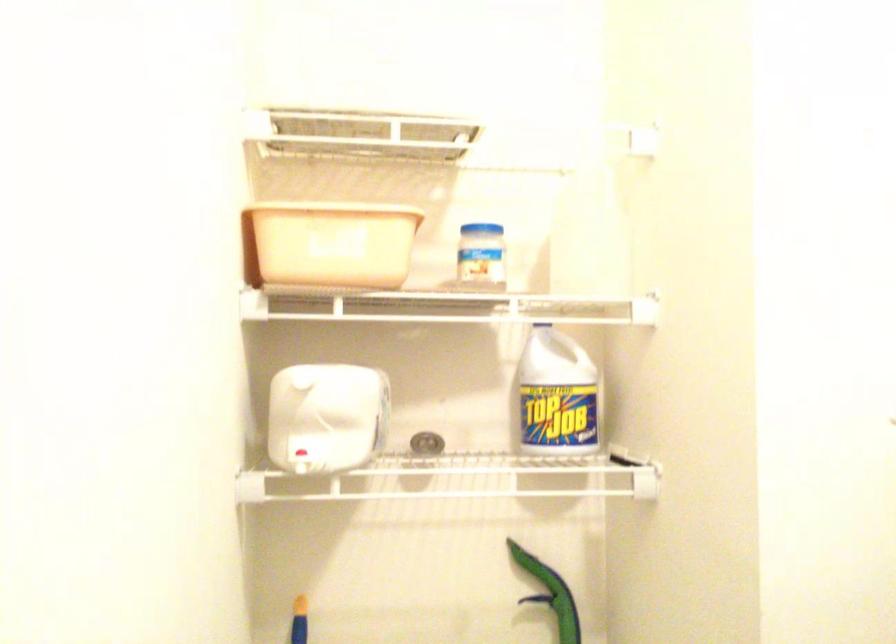
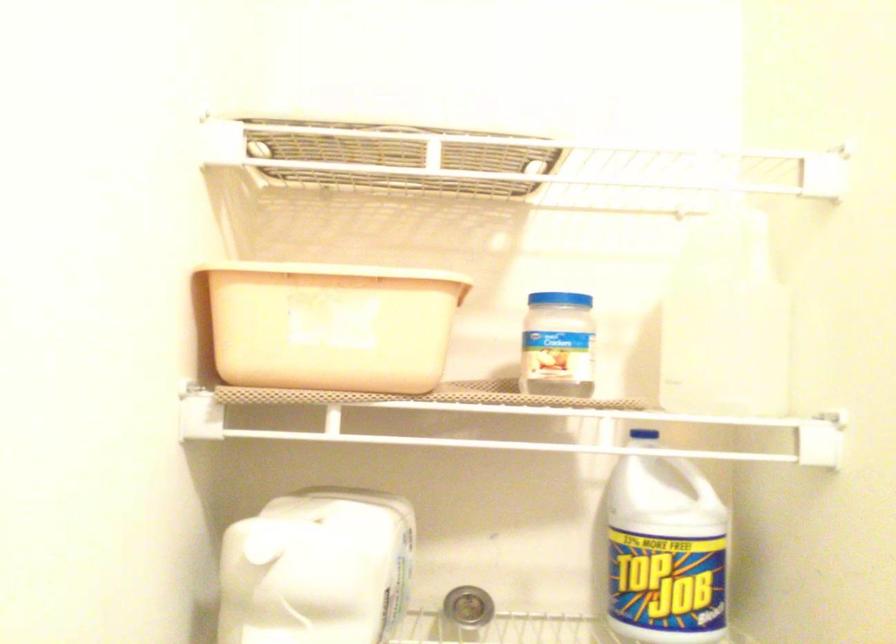
Question: The images are taken continuously from a first-person perspective. In which direction is your viewpoint rotating?

Choices:
 (A) Left
 (B) Right
 (C) Up
 (D) Down

Answer: (A)